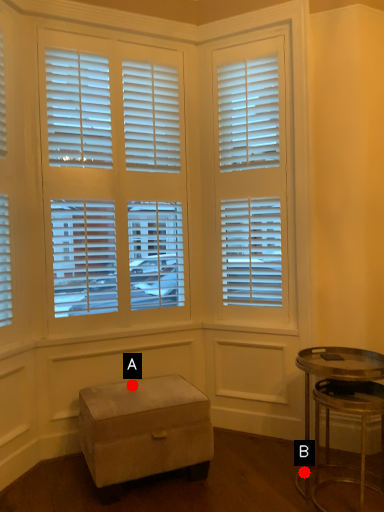
Question: Two points are circled on the image, labeled by A and B beside each circle. Which point is closer to the camera?

Choices:
 (A) A is closer
 (B) B is closer

Answer: (B)